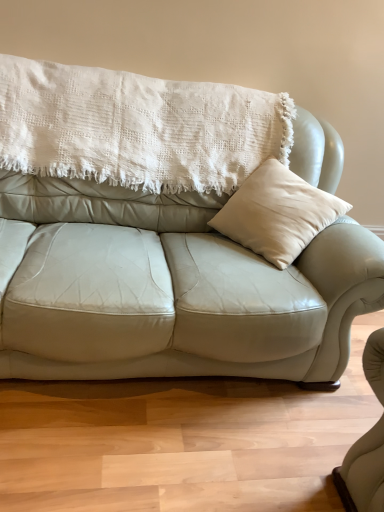
Question: Should I look upward or downward to see white textured blanket at upper center?

Choices:
 (A) up
 (B) down

Answer: (A)

Question: From the image's perspective, is light beige leather couch at center under white textured blanket at upper center?

Choices:
 (A) yes
 (B) no

Answer: (A)

Question: Considering the relative positions of light beige leather couch at center and white textured blanket at upper center in the image provided, is light beige leather couch at center behind white textured blanket at upper center?

Choices:
 (A) yes
 (B) no

Answer: (B)

Question: Can you confirm if light beige leather couch at center is smaller than white textured blanket at upper center?

Choices:
 (A) no
 (B) yes

Answer: (A)

Question: Is light beige leather couch at center at the right side of white textured blanket at upper center?

Choices:
 (A) yes
 (B) no

Answer: (A)

Question: Is light beige leather couch at center thinner than white textured blanket at upper center?

Choices:
 (A) yes
 (B) no

Answer: (B)

Question: From the image's perspective, is light beige leather couch at center over white textured blanket at upper center?

Choices:
 (A) yes
 (B) no

Answer: (B)

Question: Is white textured blanket at upper center oriented away from light beige leather couch at center?

Choices:
 (A) no
 (B) yes

Answer: (B)

Question: Is white textured blanket at upper center in front of light beige leather couch at center?

Choices:
 (A) no
 (B) yes

Answer: (A)

Question: Would you consider white textured blanket at upper center to be distant from light beige leather couch at center?

Choices:
 (A) yes
 (B) no

Answer: (B)

Question: Is white textured blanket at upper center completely or partially outside of light beige leather couch at center?

Choices:
 (A) yes
 (B) no

Answer: (B)

Question: Can you confirm if white textured blanket at upper center is thinner than light beige leather couch at center?

Choices:
 (A) yes
 (B) no

Answer: (A)

Question: Does white textured blanket at upper center have a smaller size compared to light beige leather couch at center?

Choices:
 (A) yes
 (B) no

Answer: (A)

Question: Considering their positions, is white textured blanket at upper center located in front of or behind light beige leather couch at center?

Choices:
 (A) behind
 (B) front

Answer: (A)